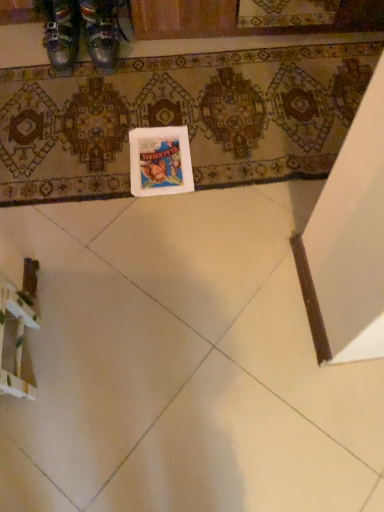
At what (x,y) coordinates should I click in order to perform the action: click on free space to the left of white matte postcard at center. Please return your answer as a coordinate pair (x, y). The width and height of the screenshot is (384, 512). Looking at the image, I should click on (92, 158).